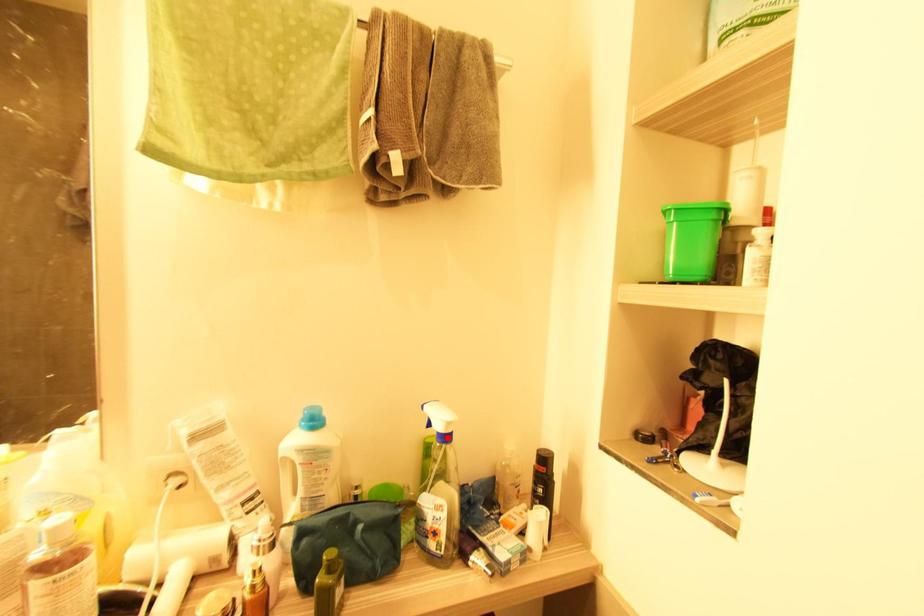
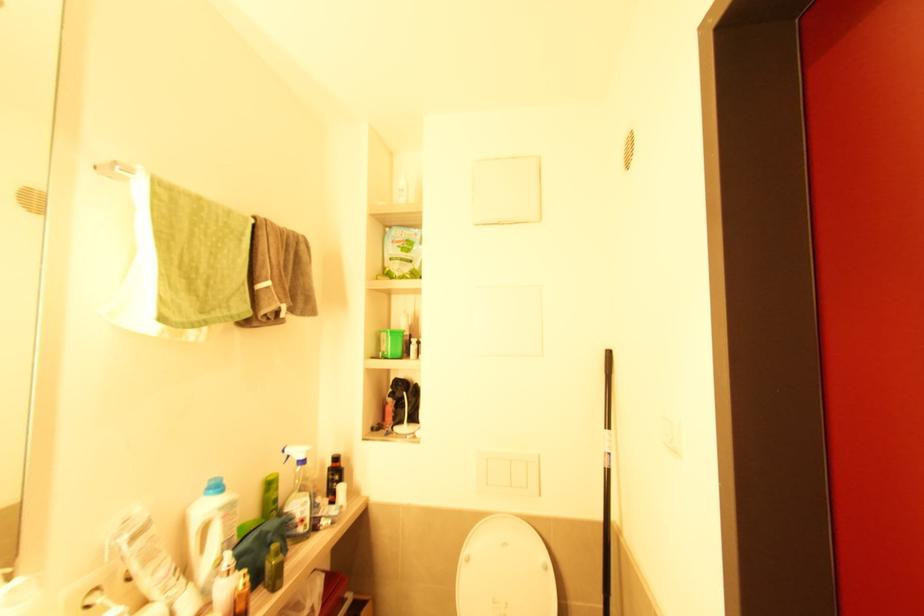
Where in the second image is the point corresponding to the highlighted location from the first image?

(305, 462)